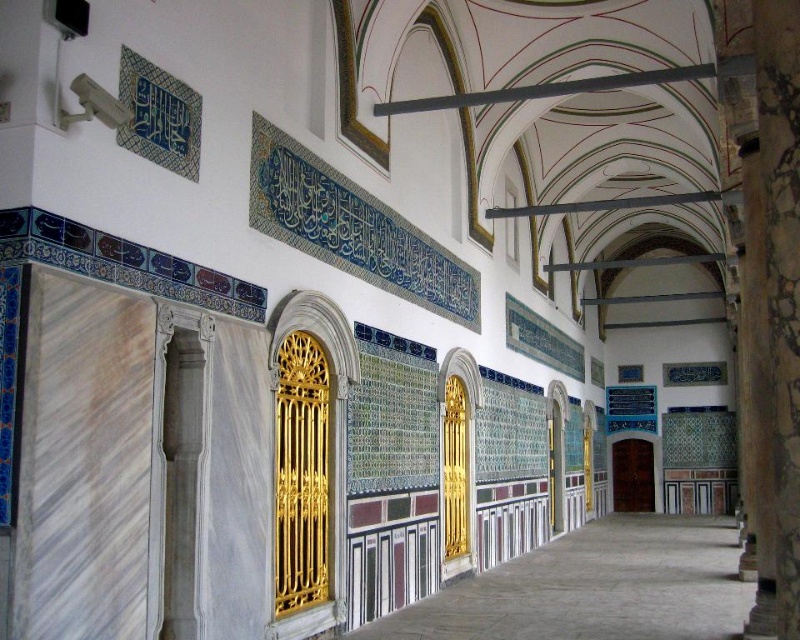
Question: Does gold metallic door at center lie in front of brown wooden door at center?

Choices:
 (A) yes
 (B) no

Answer: (A)

Question: Which point is farther from the camera taking this photo?

Choices:
 (A) (276, 509)
 (B) (641, 502)

Answer: (B)

Question: Is gold metallic door at center further to camera compared to brown wooden door at center?

Choices:
 (A) no
 (B) yes

Answer: (A)

Question: Which point is closer to the camera?

Choices:
 (A) click(640, 488)
 (B) click(280, 412)

Answer: (B)

Question: Does gold metallic door at center have a larger size compared to brown wooden door at center?

Choices:
 (A) no
 (B) yes

Answer: (B)

Question: Which point is farther to the camera?

Choices:
 (A) brown wooden door at center
 (B) gold metallic door at center

Answer: (A)